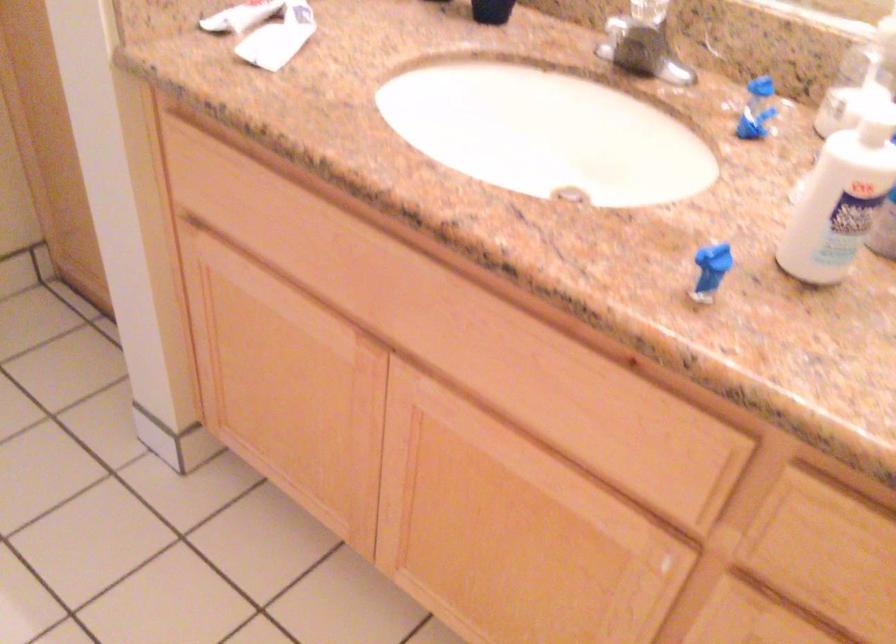
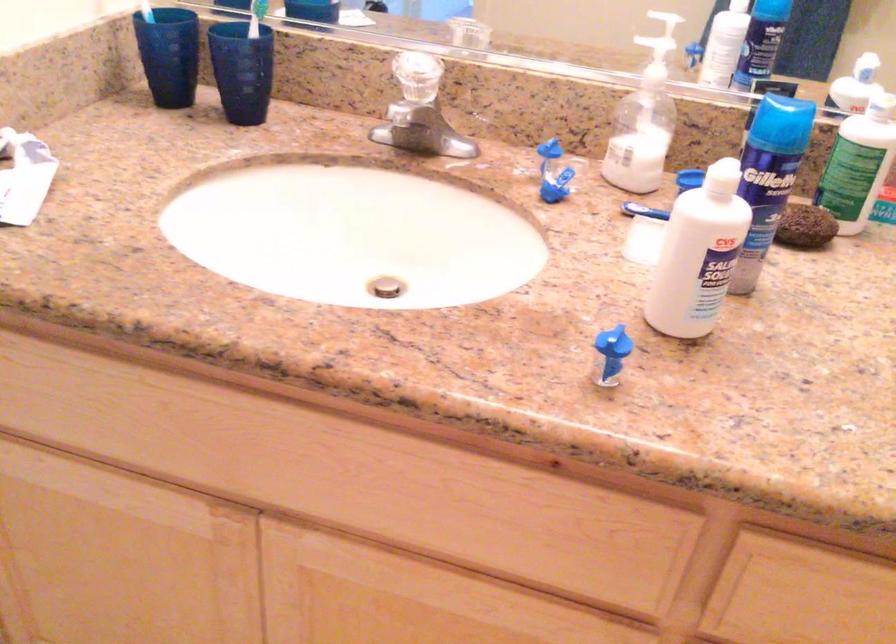
Question: The first image is from the beginning of the video and the second image is from the end. How did the camera likely rotate when shooting the video?

Choices:
 (A) Left
 (B) Right
 (C) Up
 (D) Down

Answer: (B)